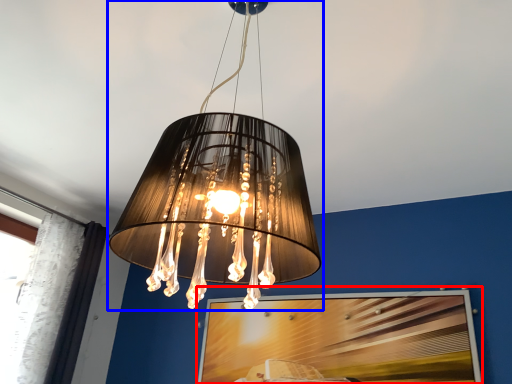
Question: Which object appears farthest to the camera in this image, picture frame (highlighted by a red box) or lamp (highlighted by a blue box)?

Choices:
 (A) picture frame
 (B) lamp

Answer: (A)